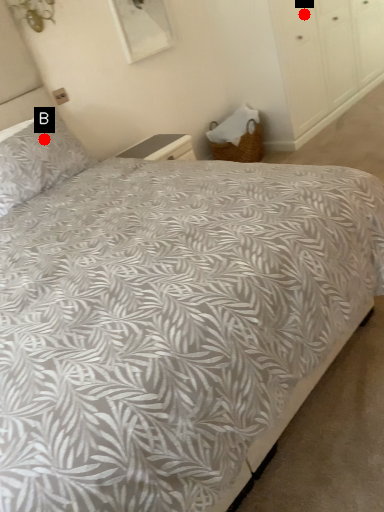
Question: Two points are circled on the image, labeled by A and B beside each circle. Which of the following is the farthest from the observer?

Choices:
 (A) A is further
 (B) B is further

Answer: (A)